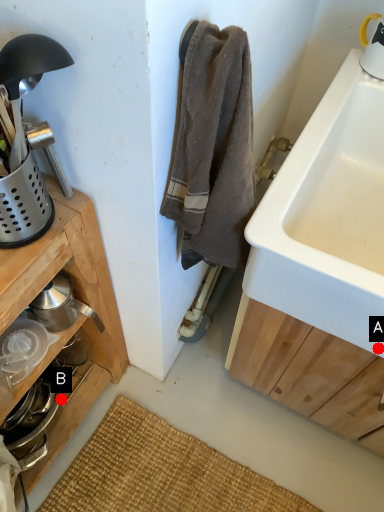
Question: Two points are circled on the image, labeled by A and B beside each circle. Which point is closer to the camera taking this photo?

Choices:
 (A) A is closer
 (B) B is closer

Answer: (A)